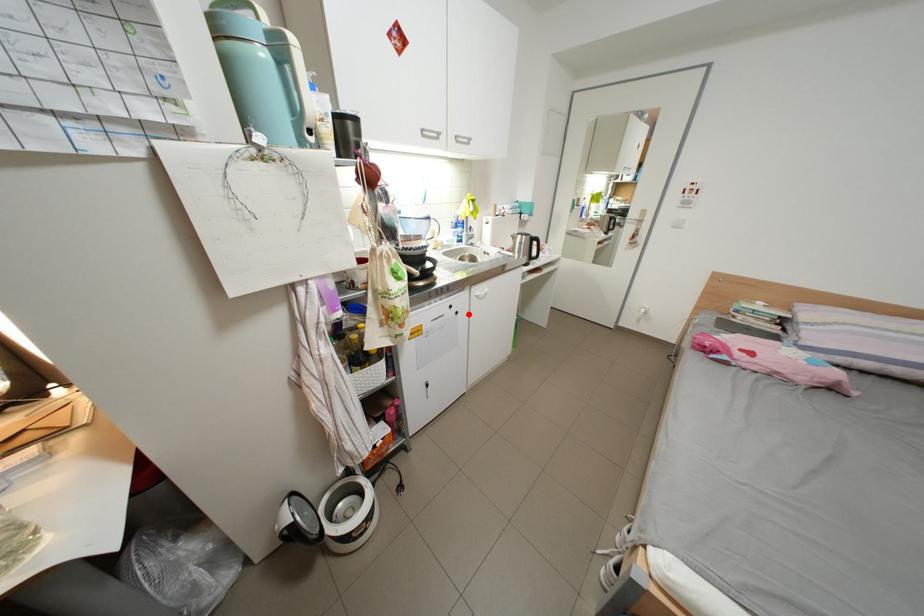
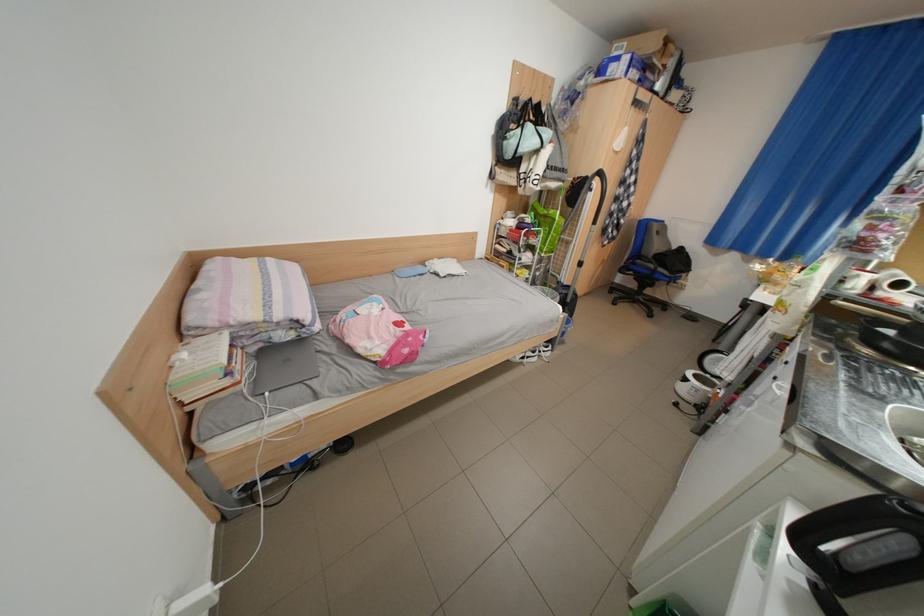
Question: I am providing you with two images of the same scene from different viewpoints. In image1, a red point is highlighted. Considering the same 3D point in image2, which of the following is correct?

Choices:
 (A) It is closer
 (B) It is farther

Answer: (B)